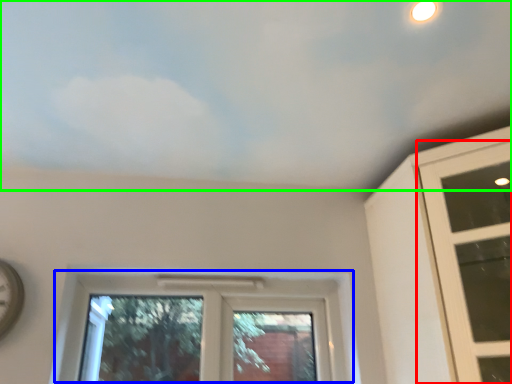
Question: Based on their relative distances, which object is nearer to window (highlighted by a red box)? Choose from window (highlighted by a blue box) and cloud (highlighted by a green box).

Choices:
 (A) window
 (B) cloud

Answer: (B)